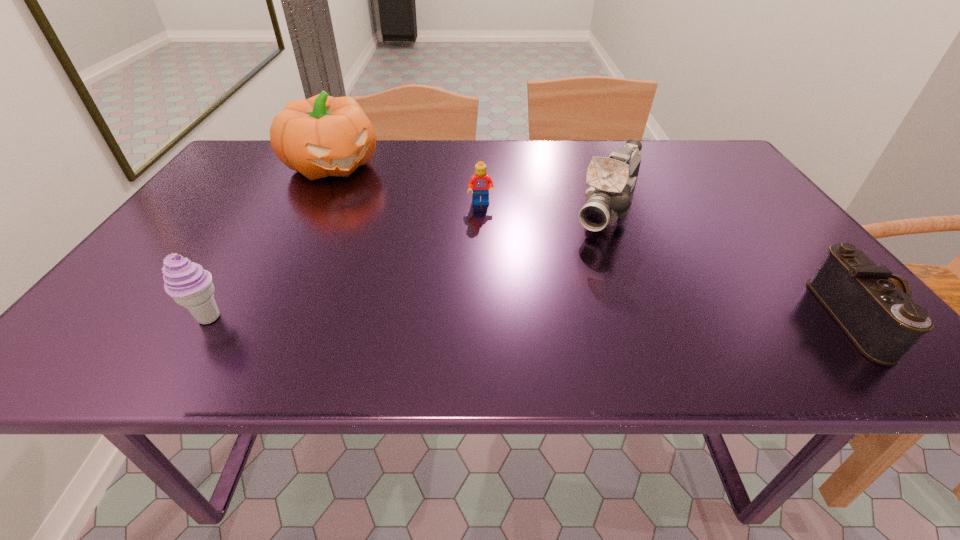
The height and width of the screenshot is (540, 960). Find the location of `free space between the pumpkin and the third object from right to left`. free space between the pumpkin and the third object from right to left is located at coordinates (407, 184).

This screenshot has height=540, width=960. Find the location of `free space between the rightmost object and the third shortest object`. free space between the rightmost object and the third shortest object is located at coordinates (533, 319).

Locate which object ranks in proximity to the pumpkin. Please provide its 2D coordinates. Your answer should be formatted as a tuple, i.e. [(x, y)], where the tuple contains the x and y coordinates of a point satisfying the conditions above.

[(479, 184)]

Locate an element on the screen. object that stands as the closest to the third tallest object is located at coordinates (321, 136).

Locate an element on the screen. free space that satisfies the following two spatial constraints: 1. on the front side of the pumpkin; 2. on the lens of the camera is located at coordinates (255, 318).

Identify the location of vacant area in the image that satisfies the following two spatial constraints: 1. on the back side of the third shortest object; 2. on the left side of the pumpkin. The width and height of the screenshot is (960, 540). (303, 164).

You are a GUI agent. You are given a task and a screenshot of the screen. Output one action in this format:
    pyautogui.click(x=<x>, y=<y>)
    Task: Click on the vacant position in the image that satisfies the following two spatial constraints: 1. on the front side of the pumpkin; 2. on the right side of the Lego
    The image size is (960, 540).
    Given the screenshot: What is the action you would take?
    pyautogui.click(x=314, y=204)